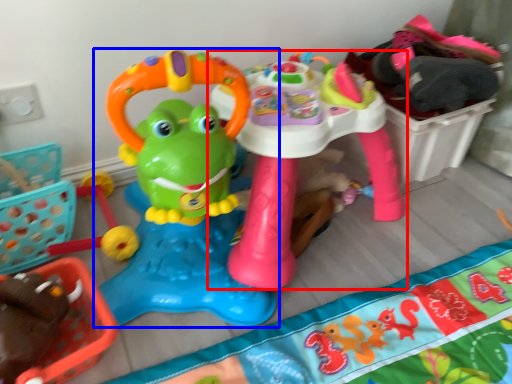
Question: Which object appears closest to the camera in this image, toy (highlighted by a red box) or toy (highlighted by a blue box)?

Choices:
 (A) toy
 (B) toy

Answer: (B)